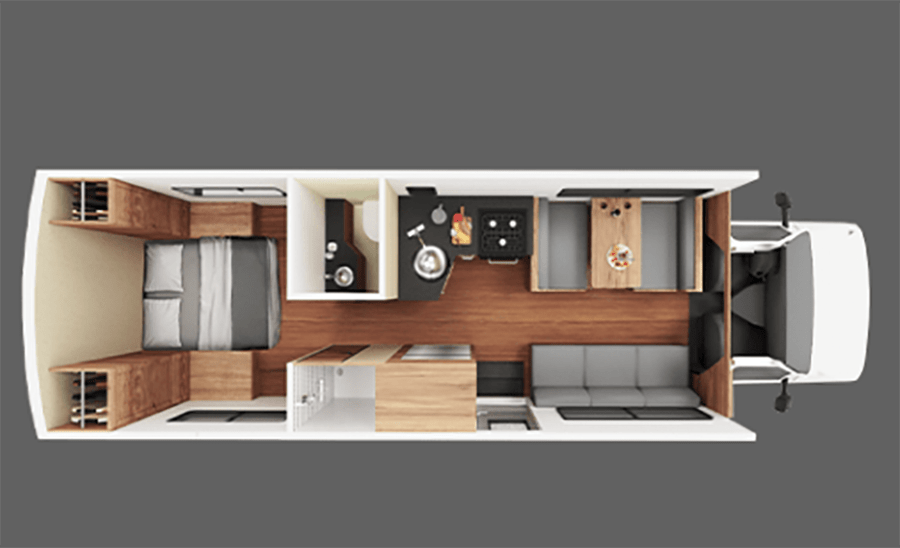
Locate an element on the screen. The height and width of the screenshot is (548, 900). pillows is located at coordinates (159, 273), (158, 321).